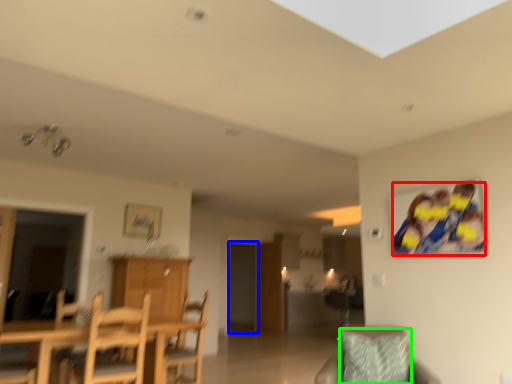
Question: Estimate the real-world distances between objects in this image. Which object is closer to couple (highlighted by a red box), glass door (highlighted by a blue box) or pillow (highlighted by a green box)?

Choices:
 (A) glass door
 (B) pillow

Answer: (B)